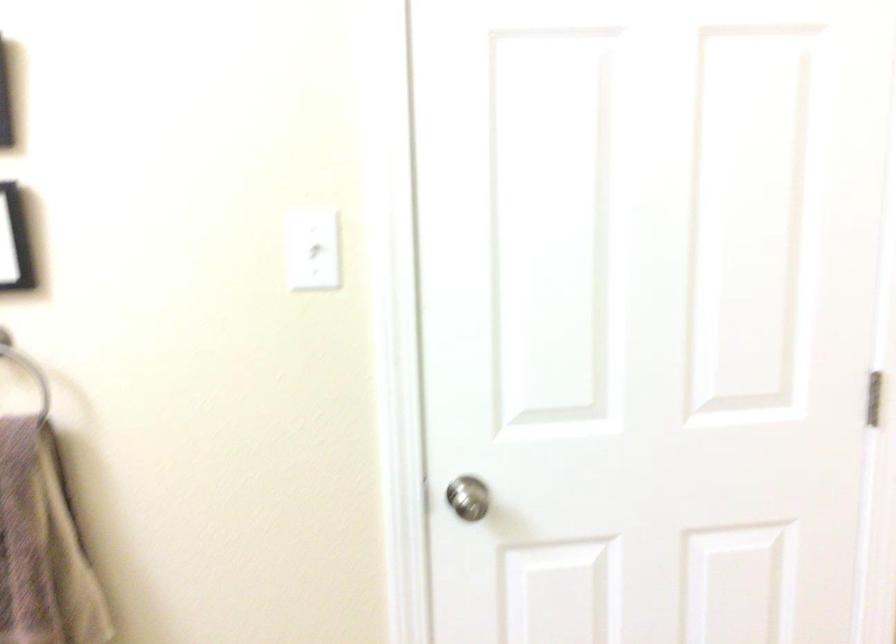
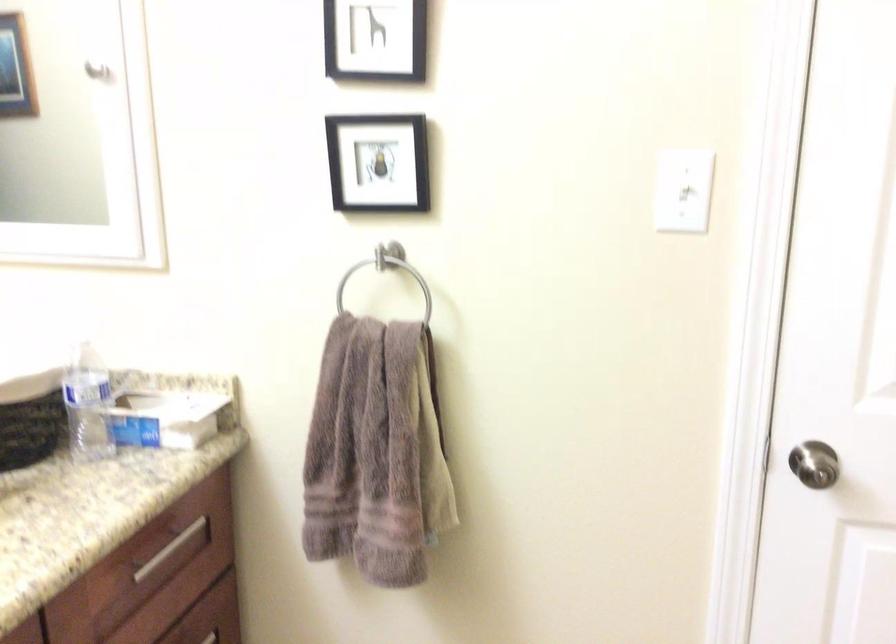
Locate, in the second image, the point that corresponds to point 467,498 in the first image.

(814, 464)